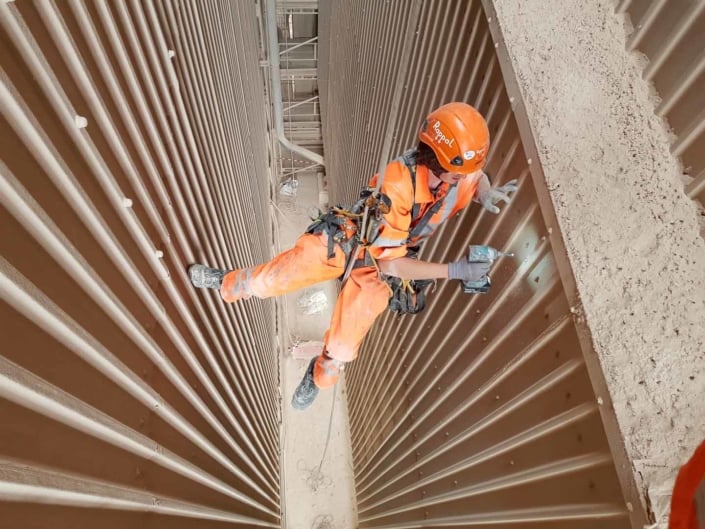
You are a GUI agent. You are given a task and a screenshot of the screen. Output one action in this format:
    pyautogui.click(x=<x>, y=<y>)
    Task: Click on the bannister
    This screenshot has width=705, height=529.
    Given the screenshot: What is the action you would take?
    pyautogui.click(x=312, y=109), pyautogui.click(x=311, y=48), pyautogui.click(x=286, y=7)